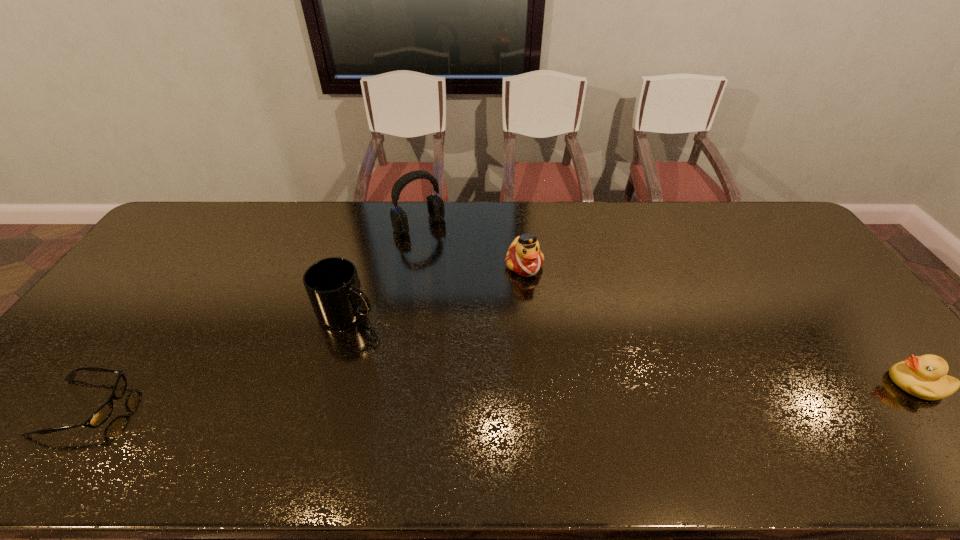
At what (x,y) coordinates should I click in order to perform the action: click on free spot that satisfies the following two spatial constraints: 1. on the front side of the mug; 2. on the front-facing side of the duckling. Please return your answer as a coordinate pair (x, y). Looking at the image, I should click on (327, 383).